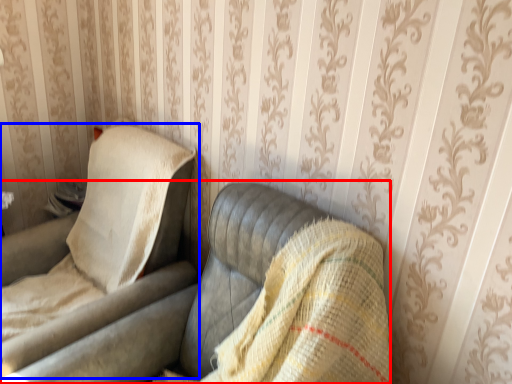
Question: Which point is further to the camera, studio couch (highlighted by a red box) or chair (highlighted by a blue box)?

Choices:
 (A) studio couch
 (B) chair

Answer: (B)